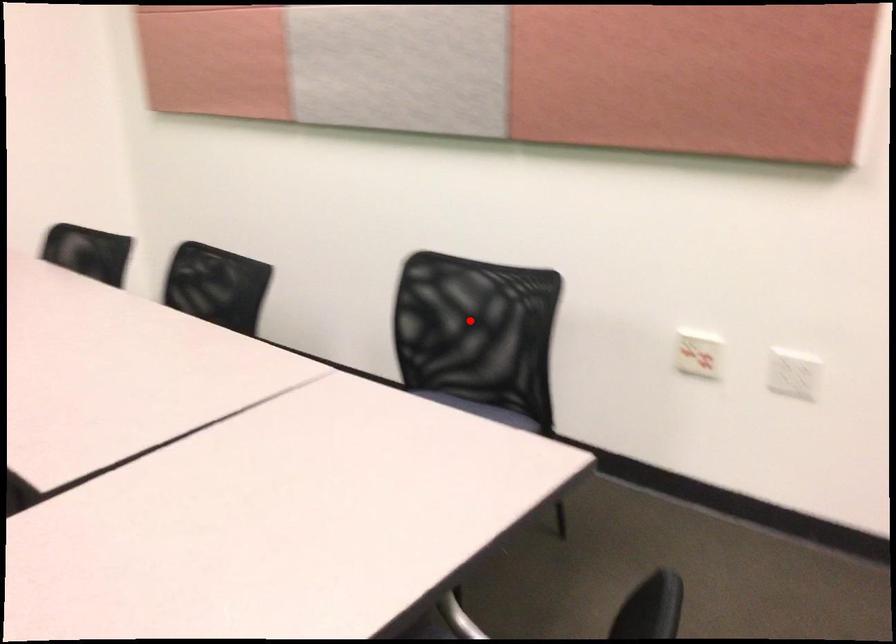
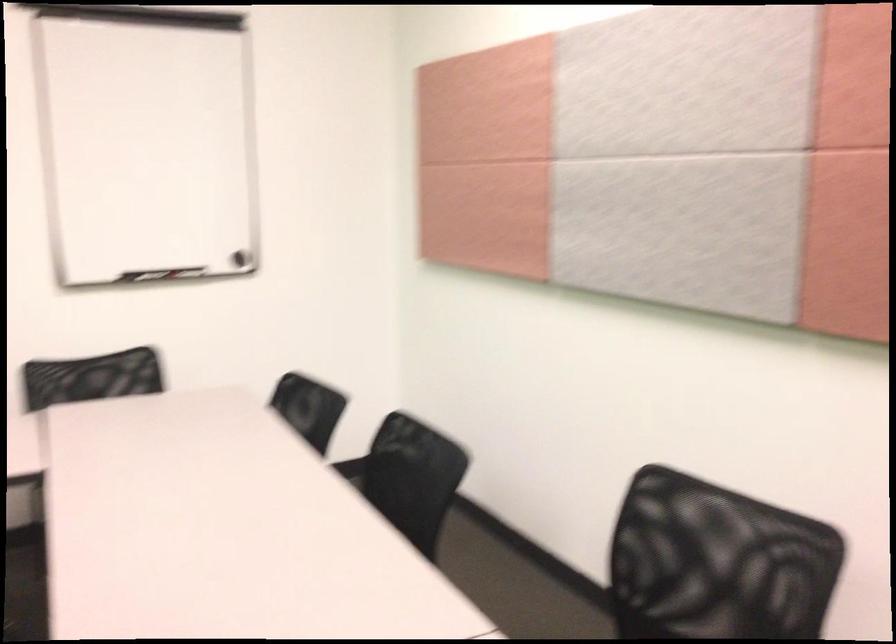
Locate, in the second image, the point that corresponds to the highlighted location in the first image.

(717, 563)